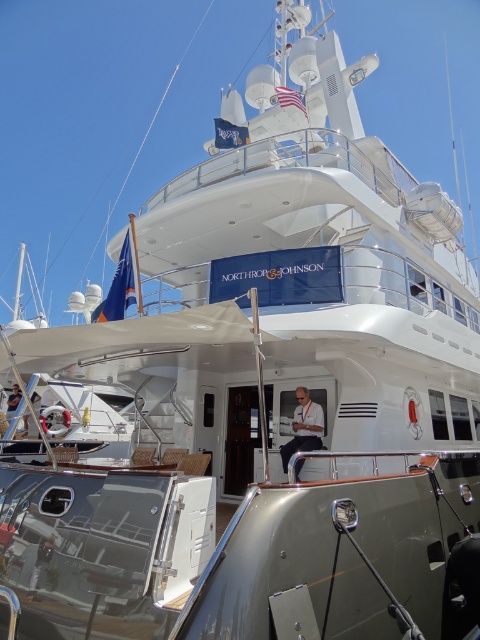
Question: Can you confirm if white fabric shirt at center is bigger than matte black laptop at upper center?

Choices:
 (A) yes
 (B) no

Answer: (B)

Question: Does white fabric shirt at center lie in front of matte black laptop at upper center?

Choices:
 (A) yes
 (B) no

Answer: (A)

Question: Observing the image, what is the correct spatial positioning of white fabric shirt at center in reference to matte black laptop at upper center?

Choices:
 (A) above
 (B) below

Answer: (A)

Question: Which point appears closest to the camera in this image?

Choices:
 (A) (12, 396)
 (B) (309, 408)

Answer: (B)